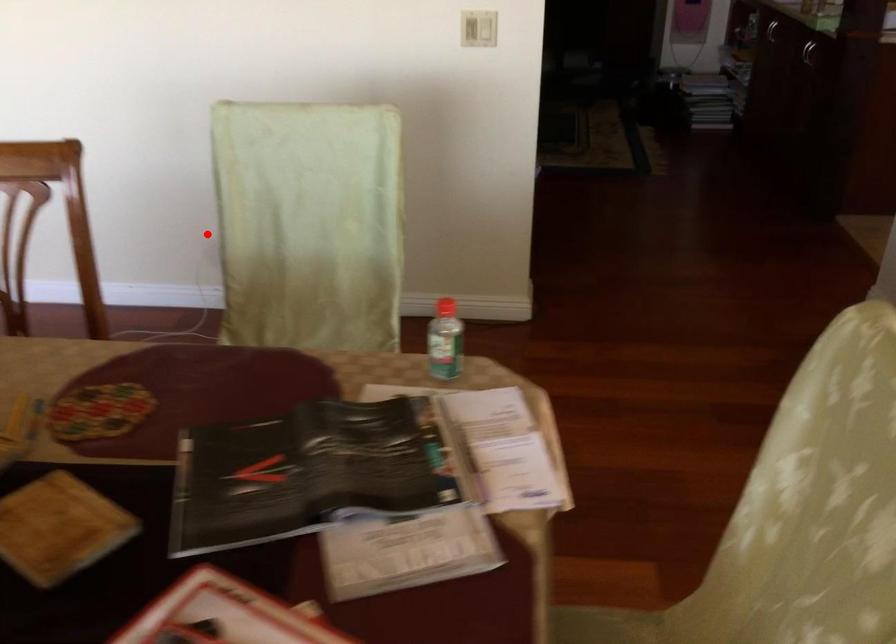
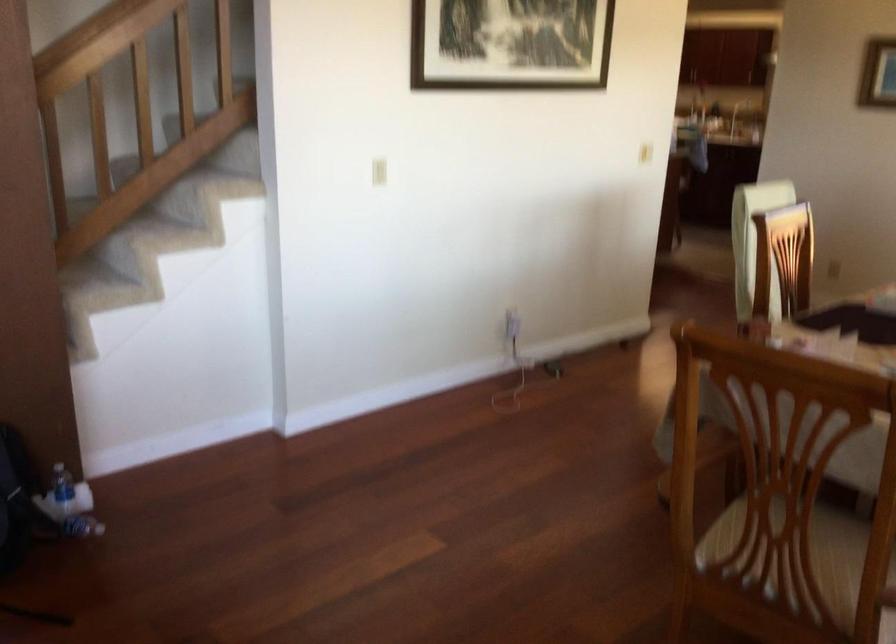
Find the pixel in the second image that matches the highlighted location in the first image.

(512, 323)